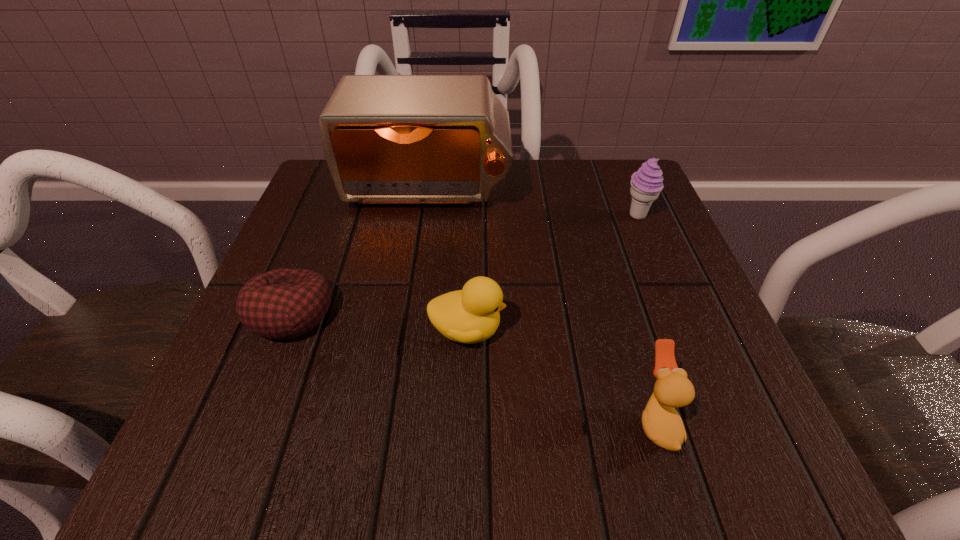
The height and width of the screenshot is (540, 960). I want to click on vacant space situated 0.400m on the beak of the fourth object from left to right, so click(333, 421).

This screenshot has width=960, height=540. I want to click on vacant area located on the beak of the fourth object from left to right, so click(439, 421).

Locate an element on the screen. vacant area situated 0.310m on the beak of the fourth object from left to right is located at coordinates (401, 421).

The height and width of the screenshot is (540, 960). I want to click on vacant area located 0.390m on the back of the beanbag, so 350,164.

Locate an element on the screen. This screenshot has height=540, width=960. toaster oven that is at the far edge is located at coordinates (387, 139).

This screenshot has height=540, width=960. Find the location of `icecream that is at the far edge`. icecream that is at the far edge is located at coordinates (646, 184).

Where is `object at the near edge`? object at the near edge is located at coordinates (662, 424).

Locate an element on the screen. This screenshot has height=540, width=960. toaster oven at the left edge is located at coordinates (387, 139).

The height and width of the screenshot is (540, 960). I want to click on beanbag that is at the left edge, so click(281, 304).

The height and width of the screenshot is (540, 960). I want to click on icecream present at the right edge, so click(646, 184).